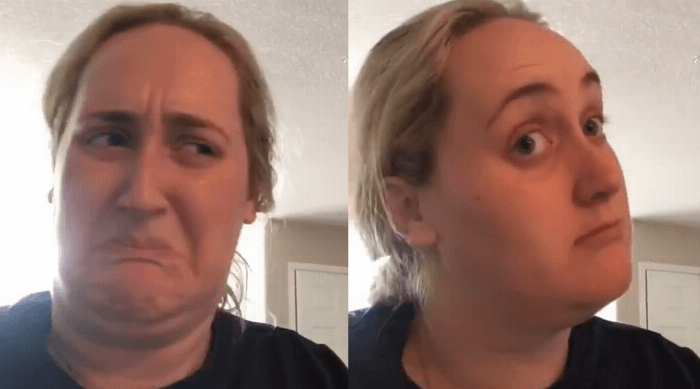
Locate an element on the screen. popcorn ceiling right pic is located at coordinates (518, 196).